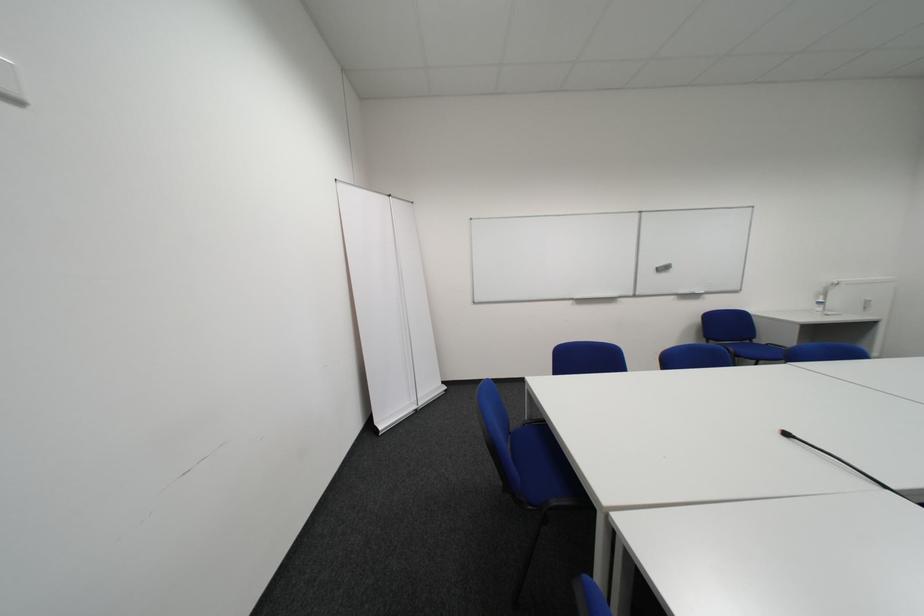
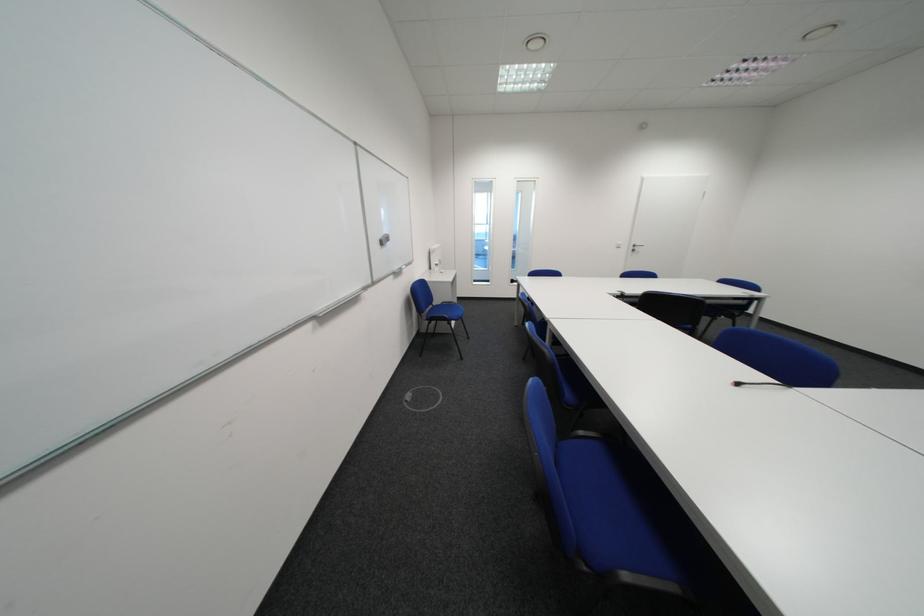
In the second image, find the point that corresponds to (x=723, y=342) in the first image.

(434, 315)